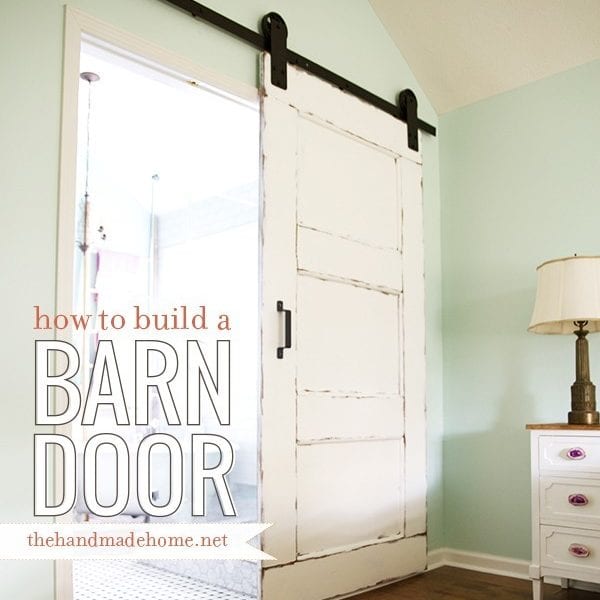
Find the location of a particular element. lamp is located at coordinates (582, 297).